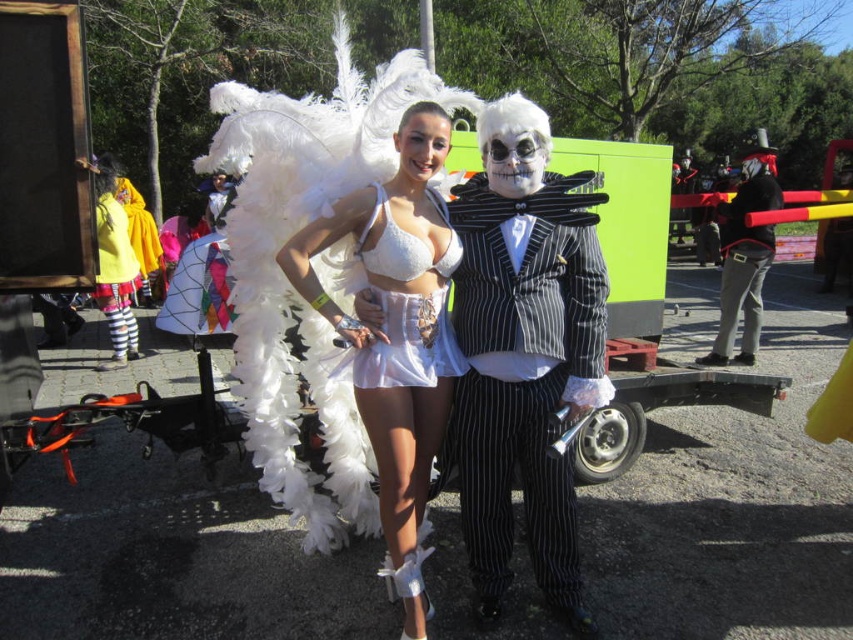
Who is positioned more to the left, matte black suit at center or matte black suit at right?

Positioned to the left is matte black suit at center.

Find the location of a particular element. The height and width of the screenshot is (640, 853). matte black suit at center is located at coordinates (524, 355).

Where is `matte black suit at center`? The width and height of the screenshot is (853, 640). matte black suit at center is located at coordinates (524, 355).

Identify the location of matte black suit at center. (524, 355).

Who is lower down, white satin dress at center or matte black suit at right?

white satin dress at center

Can you confirm if white satin dress at center is smaller than matte black suit at right?

Correct, white satin dress at center occupies less space than matte black suit at right.

Who is more distant from viewer, [367,260] or [746,307]?

Point [746,307]

Identify the location of white satin dress at center. (409, 342).

Does matte black suit at center appear on the right side of white satin dress at center?

Indeed, matte black suit at center is positioned on the right side of white satin dress at center.

The height and width of the screenshot is (640, 853). What do you see at coordinates (524, 355) in the screenshot? I see `matte black suit at center` at bounding box center [524, 355].

Is point (555, 212) positioned in front of point (416, 269)?

That is False.

This screenshot has height=640, width=853. Identify the location of matte black suit at center. (524, 355).